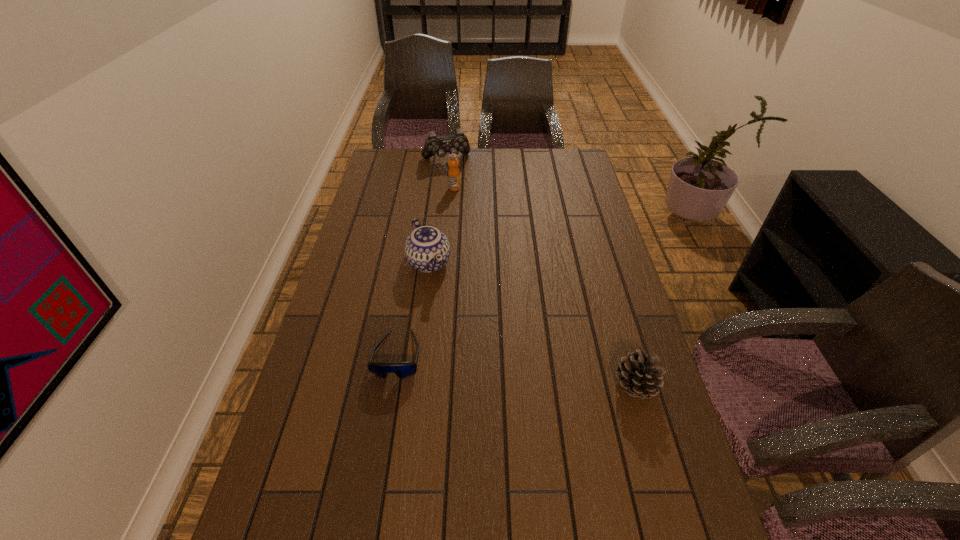
This screenshot has width=960, height=540. Find the location of `vacant space at the left edge of the desktop`. vacant space at the left edge of the desktop is located at coordinates (300, 479).

Find the location of `vacant space at the right edge`. vacant space at the right edge is located at coordinates click(654, 400).

Image resolution: width=960 pixels, height=540 pixels. In the image, there is a desktop. Find the location of `vacant space at the far right corner`. vacant space at the far right corner is located at coordinates (577, 172).

The image size is (960, 540). In the image, there is a desktop. In order to click on vacant space at the near right corner in this screenshot , I will do `click(663, 537)`.

I want to click on free point between the pinecone and the third nearest object, so (532, 325).

At what (x,y) coordinates should I click in order to perform the action: click on unoccupied position between the pinecone and the chinaware. Please return your answer as a coordinate pair (x, y). The height and width of the screenshot is (540, 960). Looking at the image, I should click on (532, 325).

In order to click on vacant area between the pinecone and the farthest object in this screenshot , I will do `click(540, 273)`.

Identify the location of vacant region between the pinecone and the fourth nearest object. (544, 287).

Image resolution: width=960 pixels, height=540 pixels. I want to click on free space between the third farthest object and the shortest object, so click(413, 309).

The image size is (960, 540). What are the coordinates of `free space between the chinaware and the shortest object` in the screenshot? It's located at (413, 309).